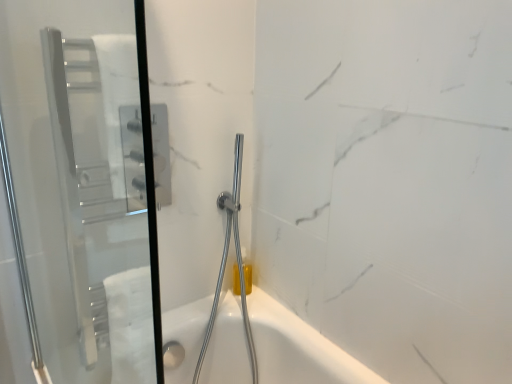
What do you see at coordinates (78, 196) in the screenshot? Image resolution: width=512 pixels, height=384 pixels. I see `transparent glass screen door at left` at bounding box center [78, 196].

I want to click on transparent glass screen door at left, so click(x=78, y=196).

Measure the distance between point (x=39, y=198) and camera.

They are 3.29 feet apart.

What do you see at coordinates (226, 261) in the screenshot?
I see `chrome metallic shower head at center` at bounding box center [226, 261].

I want to click on chrome metallic shower head at center, so click(226, 261).

Identify the location of transparent glass screen door at left. point(78,196).

Considering the relative positions of chrome metallic shower head at center and transparent glass screen door at left in the image provided, is chrome metallic shower head at center to the left or to the right of transparent glass screen door at left?

chrome metallic shower head at center is positioned on transparent glass screen door at left's right side.

Is chrome metallic shower head at center further to the viewer compared to transparent glass screen door at left?

Yes, chrome metallic shower head at center is further from the viewer.

Which is in front, point (222, 277) or point (78, 27)?

Positioned in front is point (78, 27).

From the image's perspective, is chrome metallic shower head at center located above or below transparent glass screen door at left?

chrome metallic shower head at center is below transparent glass screen door at left.

From a real-world perspective, is chrome metallic shower head at center beneath transparent glass screen door at left?

Yes.

Is chrome metallic shower head at center wider or thinner than transparent glass screen door at left?

Clearly, chrome metallic shower head at center has more width compared to transparent glass screen door at left.

Considering the sizes of chrome metallic shower head at center and transparent glass screen door at left in the image, is chrome metallic shower head at center taller or shorter than transparent glass screen door at left?

In the image, chrome metallic shower head at center appears to be taller than transparent glass screen door at left.

Can you confirm if chrome metallic shower head at center is smaller than transparent glass screen door at left?

No, chrome metallic shower head at center is not smaller than transparent glass screen door at left.

Looking at this image, is transparent glass screen door at left surrounded by chrome metallic shower head at center?

Definitely not — transparent glass screen door at left is not inside chrome metallic shower head at center.

In the scene shown: Is chrome metallic shower head at center far away from transparent glass screen door at left?

No, chrome metallic shower head at center is in close proximity to transparent glass screen door at left.

Could you tell me if chrome metallic shower head at center is turned towards transparent glass screen door at left?

No, chrome metallic shower head at center is not facing towards transparent glass screen door at left.

How different are the orientations of chrome metallic shower head at center and transparent glass screen door at left in degrees?

chrome metallic shower head at center and transparent glass screen door at left are facing 90.5 degrees away from each other.

Find the location of a particular element. screen door above the chrome metallic shower head at center (from the image's perspective) is located at coordinates (78, 196).

In the scene shown: Considering the relative positions of transparent glass screen door at left and chrome metallic shower head at center in the image provided, is transparent glass screen door at left to the left or to the right of chrome metallic shower head at center?

From the image, it's evident that transparent glass screen door at left is to the left of chrome metallic shower head at center.

Which object is closer to the camera, transparent glass screen door at left or chrome metallic shower head at center?

transparent glass screen door at left is more forward.

Which is farther from the camera, (x=42, y=101) or (x=236, y=138)?

The point (x=236, y=138) is behind.

From the image's perspective, is transparent glass screen door at left located above or below chrome metallic shower head at center?

transparent glass screen door at left is above chrome metallic shower head at center.

From a real-world perspective, does transparent glass screen door at left stand above chrome metallic shower head at center?

Yes, from a real-world perspective, transparent glass screen door at left is on top of chrome metallic shower head at center.

Which of these two, transparent glass screen door at left or chrome metallic shower head at center, is wider?

Wider between the two is chrome metallic shower head at center.

Does transparent glass screen door at left have a greater height compared to chrome metallic shower head at center?

Incorrect, the height of transparent glass screen door at left is not larger of that of chrome metallic shower head at center.

Based on their sizes in the image, would you say transparent glass screen door at left is bigger or smaller than chrome metallic shower head at center?

Clearly, transparent glass screen door at left is smaller in size than chrome metallic shower head at center.

Choose the correct answer: Is transparent glass screen door at left inside chrome metallic shower head at center or outside it?

transparent glass screen door at left is outside chrome metallic shower head at center.

Is transparent glass screen door at left far from chrome metallic shower head at center?

No, transparent glass screen door at left is not far from chrome metallic shower head at center.

Could you tell me if transparent glass screen door at left is turned towards chrome metallic shower head at center?

No, transparent glass screen door at left is not oriented towards chrome metallic shower head at center.

How different are the orientations of transparent glass screen door at left and chrome metallic shower head at center in degrees?

90.5 degrees.

This screenshot has width=512, height=384. What are the coordinates of `screen door located above the chrome metallic shower head at center (from a real-world perspective)` in the screenshot? It's located at (78, 196).

Where is `shower below the transparent glass screen door at left (from the image's perspective)`? shower below the transparent glass screen door at left (from the image's perspective) is located at coordinates (226, 261).

Locate an element on the screen. This screenshot has width=512, height=384. screen door above the chrome metallic shower head at center (from the image's perspective) is located at coordinates (78, 196).